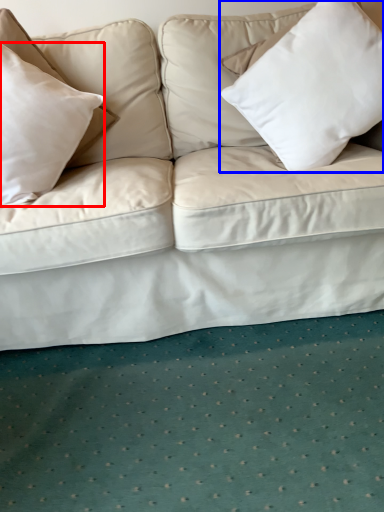
Question: Among these objects, which one is nearest to the camera, pillow (highlighted by a red box) or pillow (highlighted by a blue box)?

Choices:
 (A) pillow
 (B) pillow

Answer: (A)